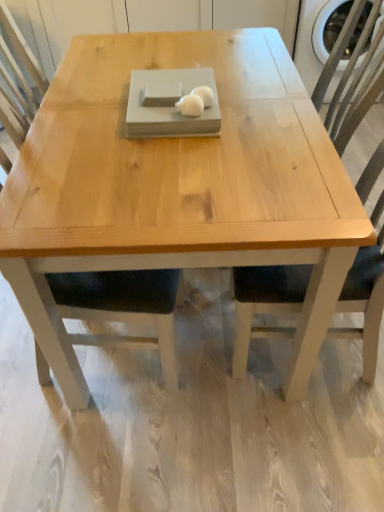
Question: Would you consider white matte eggs at center, marked as the second food in a left-to-right arrangement, to be distant from natural wood chair at right?

Choices:
 (A) no
 (B) yes

Answer: (A)

Question: Is white matte eggs at center, the first food from the right, at the left side of natural wood chair at right?

Choices:
 (A) yes
 (B) no

Answer: (A)

Question: Does white matte eggs at center, marked as the second food in a left-to-right arrangement, have a larger size compared to natural wood chair at right?

Choices:
 (A) yes
 (B) no

Answer: (B)

Question: Is white matte eggs at center, the first food from the right, not inside natural wood chair at right?

Choices:
 (A) yes
 (B) no

Answer: (A)

Question: Is natural wood chair at right inside white matte eggs at center, marked as the second food in a left-to-right arrangement?

Choices:
 (A) yes
 (B) no

Answer: (B)

Question: From a real-world perspective, is white matte mouse at center, which appears as the 1th food when viewed from the left, physically located above or below natural wood chair at right?

Choices:
 (A) above
 (B) below

Answer: (A)

Question: Is white matte mouse at center, placed as the second food when sorted from right to left, bigger or smaller than natural wood chair at right?

Choices:
 (A) small
 (B) big

Answer: (A)

Question: In the image, is white matte mouse at center, placed as the second food when sorted from right to left, on the left side or the right side of natural wood chair at right?

Choices:
 (A) right
 (B) left

Answer: (B)

Question: Considering the positions of white matte mouse at center, which appears as the 1th food when viewed from the left, and natural wood chair at right in the image, is white matte mouse at center, which appears as the 1th food when viewed from the left, taller or shorter than natural wood chair at right?

Choices:
 (A) short
 (B) tall

Answer: (A)

Question: Would you say natural wood coffee table at center is inside or outside white matte mouse at center, which appears as the 1th food when viewed from the left?

Choices:
 (A) inside
 (B) outside

Answer: (B)

Question: In the image, is natural wood coffee table at center on the left side or the right side of white matte mouse at center, placed as the second food when sorted from right to left?

Choices:
 (A) right
 (B) left

Answer: (A)

Question: From a real-world perspective, is natural wood coffee table at center positioned above or below white matte mouse at center, which appears as the 1th food when viewed from the left?

Choices:
 (A) above
 (B) below

Answer: (B)

Question: In terms of width, does natural wood coffee table at center look wider or thinner when compared to white matte mouse at center, which appears as the 1th food when viewed from the left?

Choices:
 (A) wide
 (B) thin

Answer: (A)

Question: From the image's perspective, is white matte eggs at center, the first food from the right, above or below natural wood coffee table at center?

Choices:
 (A) above
 (B) below

Answer: (A)

Question: From their relative heights in the image, would you say white matte eggs at center, the first food from the right, is taller or shorter than natural wood coffee table at center?

Choices:
 (A) tall
 (B) short

Answer: (B)